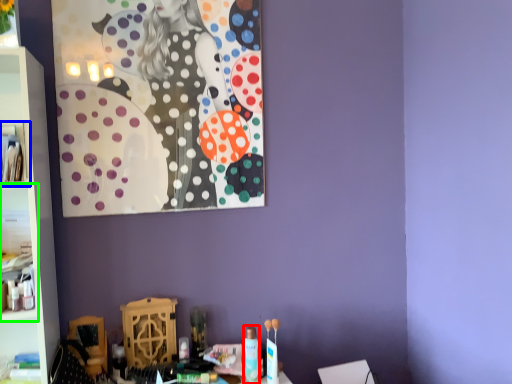
Question: Estimate the real-world distances between objects in this image. Which object is farther from toiletry (highlighted by a red box), cabinet (highlighted by a blue box) or cabinet (highlighted by a green box)?

Choices:
 (A) cabinet
 (B) cabinet

Answer: (A)